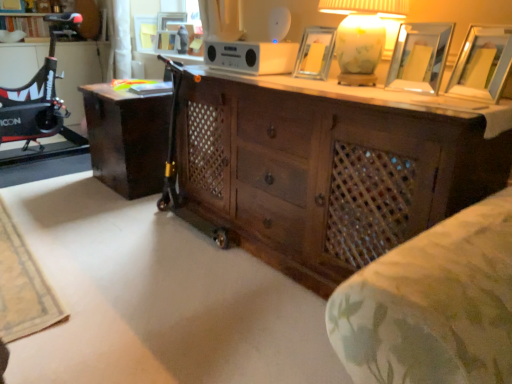
At what (x,y) coordinates should I click in order to perform the action: click on vacant area situated to the left side of matte glass table lamp at upper right. Please return your answer as a coordinate pair (x, y). Looking at the image, I should click on (286, 81).